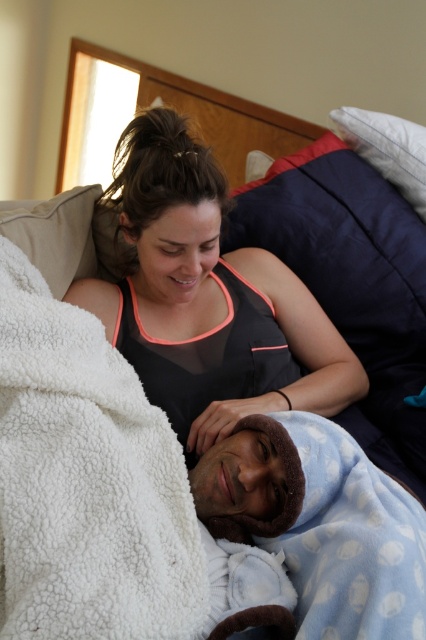
You are standing at the center of the room and want to reach the blue fleece blanket at lower right. According to the coordinates provided, in which direction should you move from your current position?

The blue fleece blanket at lower right is located at coordinates point (342, 534), so you should move towards the lower right direction from your current position at the center of the room.

You are standing in the room and want to place a small lamp between the two points, point (x=345, y=512) and point (x=60, y=243). Which point should the lamp be closer to if you want it to be nearer to the viewer?

The lamp should be placed closer to point (x=345, y=512) because it is closer to the viewer than point (x=60, y=243).

You are a photographer setting up a shoot in this room. You need to place a small prop between the black mesh tank top at center and the navy blue pillow at upper right. Where should you place it so that it is equidistant from both objects?

The prop should be placed midway between the black mesh tank top at center and the navy blue pillow at upper right to ensure it is equidistant from both.